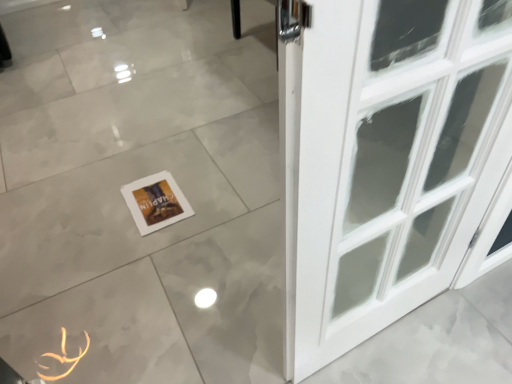
What do you see at coordinates (156, 202) in the screenshot?
I see `white paper at lower center` at bounding box center [156, 202].

Describe the element at coordinates (136, 179) in the screenshot. I see `white glossy tile at center` at that location.

Identify the location of orange rubber band at lower left. The height and width of the screenshot is (384, 512). (64, 358).

What do you see at coordinates (64, 358) in the screenshot? This screenshot has height=384, width=512. I see `orange rubber band at lower left` at bounding box center [64, 358].

The height and width of the screenshot is (384, 512). I want to click on white paper at lower center, so click(156, 202).

From the picture: Between white paper at lower center and orange rubber band at lower left, which one is positioned behind?

white paper at lower center is further away from the camera.

Measure the distance between white paper at lower center and orange rubber band at lower left.

white paper at lower center is 21.59 inches from orange rubber band at lower left.

Based on the photo, considering the sizes of white paper at lower center and orange rubber band at lower left in the image, is white paper at lower center wider or thinner than orange rubber band at lower left?

white paper at lower center is wider than orange rubber band at lower left.

From the image's perspective, is white paper at lower center located beneath orange rubber band at lower left?

No, from the image's perspective, white paper at lower center is not below orange rubber band at lower left.

Locate an element on the screen. ceramic tile lying above the white paper at lower center (from the image's perspective) is located at coordinates (136, 179).

In the scene shown: Is white glossy tile at center facing towards white paper at lower center?

No, white glossy tile at center is not aimed at white paper at lower center.

Measure the distance between white glossy tile at center and white paper at lower center.

white glossy tile at center is 34.09 centimeters away from white paper at lower center.

Consider the image. From a real-world perspective, is white glossy tile at center above or below white paper at lower center?

From a real-world perspective, white glossy tile at center is physically below white paper at lower center.

Between white paper at lower center and white glossy tile at center, which one has smaller width?

With smaller width is white paper at lower center.

Choose the correct answer: Is white paper at lower center inside white glossy tile at center or outside it?

white paper at lower center exists entirely within white glossy tile at center.

Does point (184, 215) appear closer or farther from the camera than point (112, 247)?

Point (184, 215) is positioned farther from the camera compared to point (112, 247).

From the image's perspective, which is above, white paper at lower center or white glossy tile at center?

white glossy tile at center is shown above in the image.

Considering the relative sizes of orange rubber band at lower left and white glossy tile at center in the image provided, is orange rubber band at lower left bigger than white glossy tile at center?

No.

Is white glossy tile at center inside orange rubber band at lower left?

Definitely not — white glossy tile at center is not inside orange rubber band at lower left.

Can you confirm if orange rubber band at lower left is shorter than white glossy tile at center?

Yes.

In the image, is orange rubber band at lower left on the left side or the right side of white glossy tile at center?

Based on their positions, orange rubber band at lower left is located to the left of white glossy tile at center.

Between orange rubber band at lower left and white paper at lower center, which one has more height?

white paper at lower center is taller.

Does point (46, 378) lie in front of point (180, 207)?

Yes, it is.

The width and height of the screenshot is (512, 384). Identify the location of picture frame that appears behind the orange rubber band at lower left. (156, 202).

Does white glossy tile at center appear on the right side of orange rubber band at lower left?

Indeed, white glossy tile at center is positioned on the right side of orange rubber band at lower left.

From a real-world perspective, relative to orange rubber band at lower left, is white glossy tile at center vertically above or below?

white glossy tile at center is below orange rubber band at lower left.

Between white glossy tile at center and orange rubber band at lower left, which one has larger size?

white glossy tile at center is bigger.

Is point (209, 258) closer or farther from the camera than point (83, 356)?

Clearly, point (209, 258) is more distant from the camera than point (83, 356).

At what (x,y) coordinates should I click in order to perform the action: click on print on the left side of white paper at lower center. Please return your answer as a coordinate pair (x, y). This screenshot has height=384, width=512. Looking at the image, I should click on (64, 358).

Where is `ceramic tile in front of the white paper at lower center`? ceramic tile in front of the white paper at lower center is located at coordinates (136, 179).

From the image, which object appears to be farther from white glossy tile at center, white paper at lower center or orange rubber band at lower left?

Among the two, orange rubber band at lower left is located further to white glossy tile at center.

From the image, which object appears to be farther from white glossy tile at center, orange rubber band at lower left or white paper at lower center?

Among the two, orange rubber band at lower left is located further to white glossy tile at center.

Which object lies further to the anchor point white paper at lower center, white glossy tile at center or orange rubber band at lower left?

orange rubber band at lower left lies further to white paper at lower center than the other object.

Based on their spatial positions, is white paper at lower center or white glossy tile at center further from orange rubber band at lower left?

white glossy tile at center.

Considering their positions, is orange rubber band at lower left positioned closer to white paper at lower center than white glossy tile at center?

The object closer to white paper at lower center is white glossy tile at center.

Estimate the real-world distances between objects in this image. Which object is further from orange rubber band at lower left, white glossy tile at center or white paper at lower center?

Based on the image, white glossy tile at center appears to be further to orange rubber band at lower left.

Where is `picture frame between white glossy tile at center and orange rubber band at lower left vertically`? This screenshot has height=384, width=512. picture frame between white glossy tile at center and orange rubber band at lower left vertically is located at coordinates (156, 202).